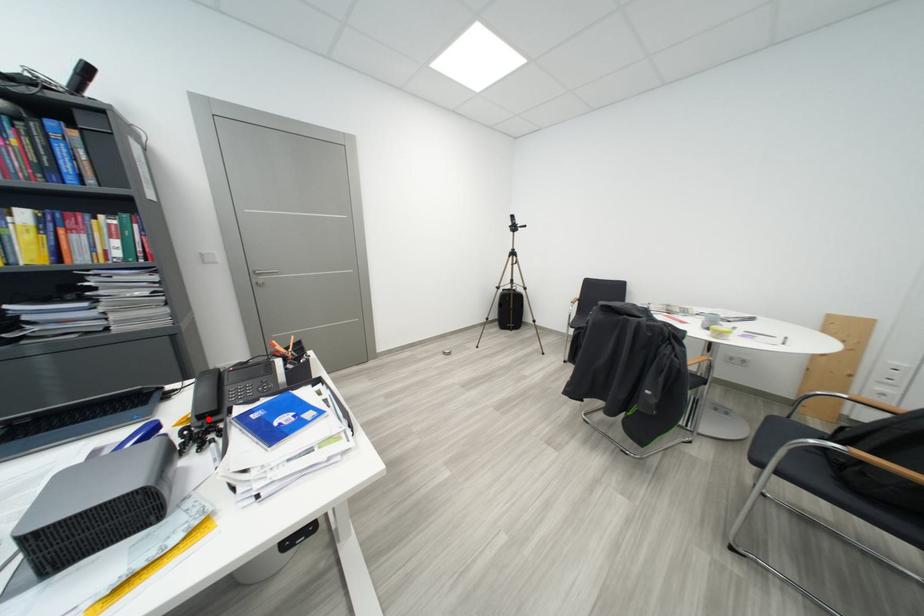
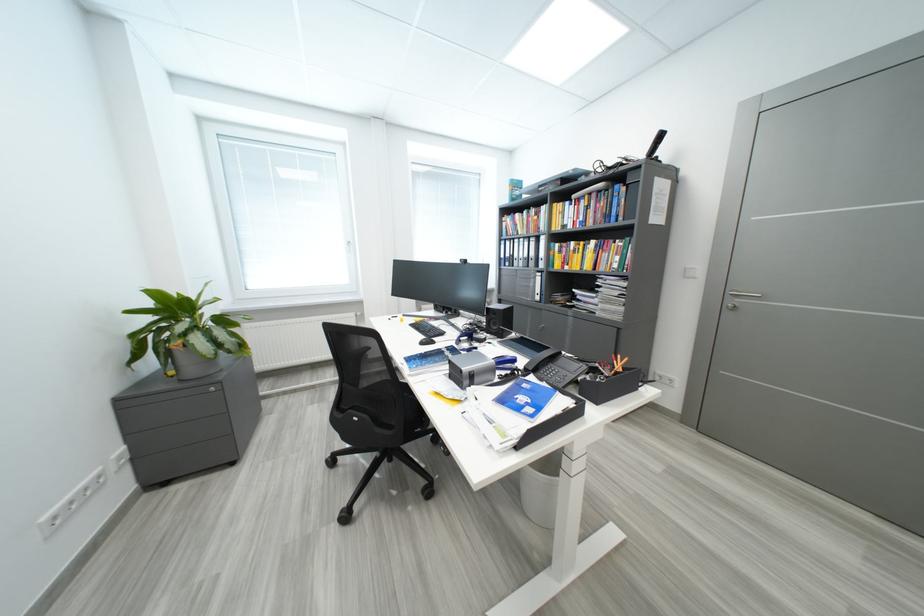
Find the pixel in the second image that matches the highlighted location in the first image.

(535, 371)